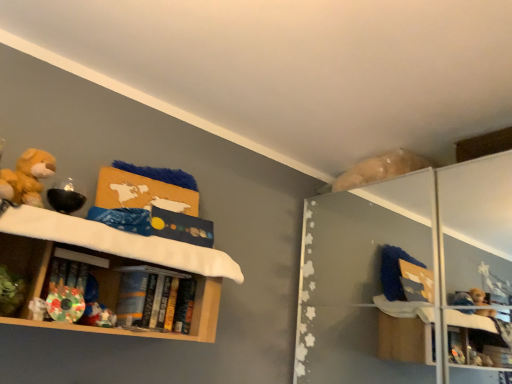
Question: From the image's perspective, relative to wooden shelf at left, is fluffy yellow teddy bear at left above or below?

Choices:
 (A) above
 (B) below

Answer: (A)

Question: From a real-world perspective, relative to wooden shelf at left, is fluffy yellow teddy bear at left vertically above or below?

Choices:
 (A) above
 (B) below

Answer: (A)

Question: Estimate the real-world distances between objects in this image. Which object is closer to the wooden shelf at left?

Choices:
 (A) hardcover books at shelf center
 (B) fluffy yellow teddy bear at left

Answer: (A)

Question: Considering the real-world distances, which object is farthest from the fluffy yellow teddy bear at left?

Choices:
 (A) hardcover books at shelf center
 (B) wooden shelf at left

Answer: (A)